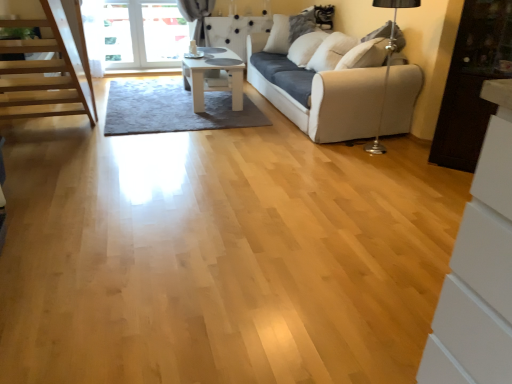
Question: From a real-world perspective, is white soft pillow at upper center under dark wood cabinet at right?

Choices:
 (A) yes
 (B) no

Answer: (B)

Question: Can you confirm if white soft pillow at upper center is smaller than dark wood cabinet at right?

Choices:
 (A) yes
 (B) no

Answer: (A)

Question: Is white soft pillow at upper center outside of dark wood cabinet at right?

Choices:
 (A) yes
 (B) no

Answer: (A)

Question: Does white soft pillow at upper center appear on the right side of dark wood cabinet at right?

Choices:
 (A) yes
 (B) no

Answer: (B)

Question: Would you consider white soft pillow at upper center to be distant from dark wood cabinet at right?

Choices:
 (A) yes
 (B) no

Answer: (A)

Question: Is white soft pillow at upper center aimed at dark wood cabinet at right?

Choices:
 (A) no
 (B) yes

Answer: (A)

Question: Does dark wood cabinet at right have a greater height compared to white glossy table at center?

Choices:
 (A) yes
 (B) no

Answer: (A)

Question: Would you say dark wood cabinet at right contains white glossy table at center?

Choices:
 (A) yes
 (B) no

Answer: (B)

Question: Does dark wood cabinet at right lie in front of white glossy table at center?

Choices:
 (A) no
 (B) yes

Answer: (B)

Question: Is dark wood cabinet at right at the left side of white glossy table at center?

Choices:
 (A) no
 (B) yes

Answer: (A)

Question: Is dark wood cabinet at right in contact with white glossy table at center?

Choices:
 (A) yes
 (B) no

Answer: (B)

Question: Does dark wood cabinet at right appear on the right side of white glossy table at center?

Choices:
 (A) no
 (B) yes

Answer: (B)

Question: From a real-world perspective, does white soft pillow at upper center sit lower than white fabric couch at center?

Choices:
 (A) no
 (B) yes

Answer: (A)